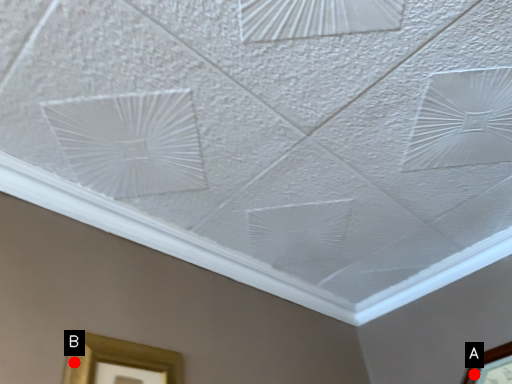
Question: Two points are circled on the image, labeled by A and B beside each circle. Among these points, which one is nearest to the camera?

Choices:
 (A) A is closer
 (B) B is closer

Answer: (B)